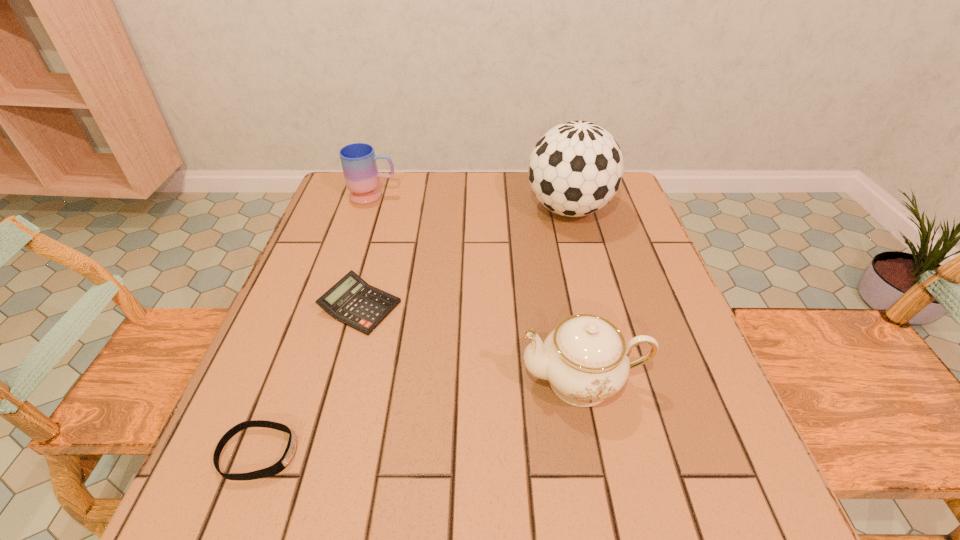
The height and width of the screenshot is (540, 960). What are the coordinates of `the closest object to the soccer ball` in the screenshot? It's located at (352, 301).

Find the location of a particular element. vacant space that satisfies the following two spatial constraints: 1. on the side of the mug with the handle; 2. on the right side of the tallest object is located at coordinates (370, 209).

You are a GUI agent. You are given a task and a screenshot of the screen. Output one action in this format:
    pyautogui.click(x=<x>, y=<y>)
    Task: Click on the vacant point that satisfies the following two spatial constraints: 1. on the side of the mug with the handle; 2. on the back side of the third farthest object
    
    Given the screenshot: What is the action you would take?
    pyautogui.click(x=338, y=306)

Locate an element on the screen. vacant position in the image that satisfies the following two spatial constraints: 1. on the front side of the soccer ball; 2. on the display of the shortest object is located at coordinates (632, 453).

Identify the location of free spot that satisfies the following two spatial constraints: 1. on the back side of the second shortest object; 2. on the side of the mug with the handle. This screenshot has height=540, width=960. (390, 195).